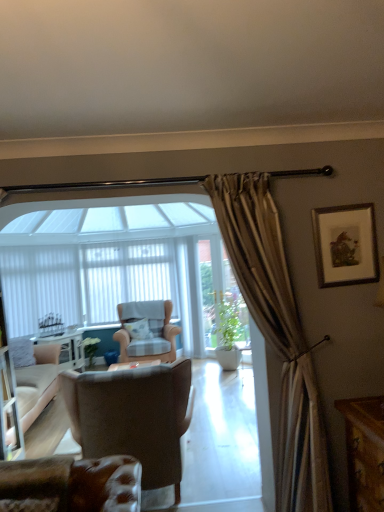
Question: From the image's perspective, does checkered fabric armchair at center, which is counted as the third chair, starting from the front, appear higher than leather at lower left, the first chair when ordered from front to back?

Choices:
 (A) yes
 (B) no

Answer: (B)

Question: Is checkered fabric armchair at center, the first chair from the back, looking in the opposite direction of leather at lower left, the first chair when ordered from front to back?

Choices:
 (A) no
 (B) yes

Answer: (A)

Question: Does checkered fabric armchair at center, the first chair from the back, lie behind leather at lower left, placed as the third chair when sorted from back to front?

Choices:
 (A) no
 (B) yes

Answer: (B)

Question: Does checkered fabric armchair at center, which is counted as the third chair, starting from the front, have a greater width compared to leather at lower left, placed as the third chair when sorted from back to front?

Choices:
 (A) yes
 (B) no

Answer: (A)

Question: Is checkered fabric armchair at center, the first chair from the back, bigger than leather at lower left, the first chair when ordered from front to back?

Choices:
 (A) no
 (B) yes

Answer: (B)

Question: From their relative heights in the image, would you say white vertical blinds at center is taller or shorter than green glossy plant at center, which ranks as the 2th plant in back-to-front order?

Choices:
 (A) short
 (B) tall

Answer: (B)

Question: Is point (148, 267) closer or farther from the camera than point (220, 323)?

Choices:
 (A) farther
 (B) closer

Answer: (B)

Question: Would you say white vertical blinds at center is inside or outside green glossy plant at center, which ranks as the 2th plant in back-to-front order?

Choices:
 (A) inside
 (B) outside

Answer: (B)

Question: Considering the positions of white vertical blinds at center and green glossy plant at center, arranged as the 1th plant when viewed from the front, in the image, is white vertical blinds at center bigger or smaller than green glossy plant at center, arranged as the 1th plant when viewed from the front,?

Choices:
 (A) big
 (B) small

Answer: (A)

Question: Considering their positions, is checkered fabric armchair at center, the first chair from the back, located in front of or behind wooden framed print at upper right?

Choices:
 (A) front
 (B) behind

Answer: (B)

Question: In terms of size, does checkered fabric armchair at center, which is counted as the third chair, starting from the front, appear bigger or smaller than wooden framed print at upper right?

Choices:
 (A) small
 (B) big

Answer: (B)

Question: From the image's perspective, is checkered fabric armchair at center, the first chair from the back, positioned above or below wooden framed print at upper right?

Choices:
 (A) above
 (B) below

Answer: (B)

Question: Is point (130, 308) positioned closer to the camera than point (321, 236)?

Choices:
 (A) farther
 (B) closer

Answer: (A)

Question: From their relative heights in the image, would you say white textured pillow at center is taller or shorter than checkered fabric armchair at center, the first chair from the back?

Choices:
 (A) tall
 (B) short

Answer: (B)

Question: In the image, is white textured pillow at center positioned in front of or behind checkered fabric armchair at center, the first chair from the back?

Choices:
 (A) front
 (B) behind

Answer: (B)